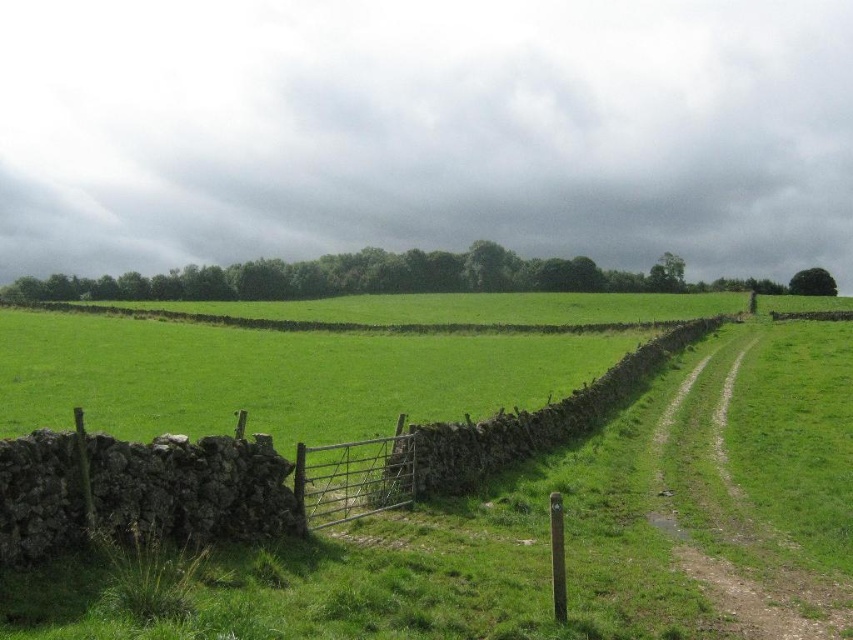
Consider the image. Is dusty gravel path at right wider than stone wall at center?

No, dusty gravel path at right is not wider than stone wall at center.

In the scene shown: Who is taller, dusty gravel path at right or stone wall at center?

Standing taller between the two is stone wall at center.

Who is more distant from viewer, (x=814, y=625) or (x=492, y=456)?

The point (x=492, y=456) is more distant.

Image resolution: width=853 pixels, height=640 pixels. I want to click on dusty gravel path at right, so 763,481.